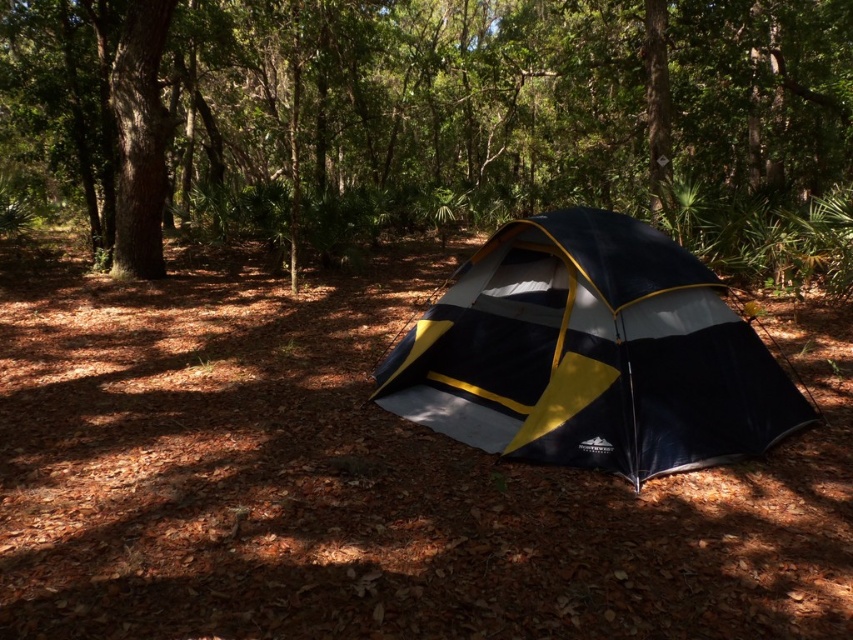
Does green leafy tree at center have a greater height compared to blue/yellow fabric tent at center?

Indeed, green leafy tree at center has a greater height compared to blue/yellow fabric tent at center.

Does green leafy tree at center appear under blue/yellow fabric tent at center?

No, green leafy tree at center is not below blue/yellow fabric tent at center.

Does point (567, 200) come in front of point (712, 401)?

That is False.

Image resolution: width=853 pixels, height=640 pixels. In order to click on green leafy tree at center in this screenshot , I will do `click(436, 120)`.